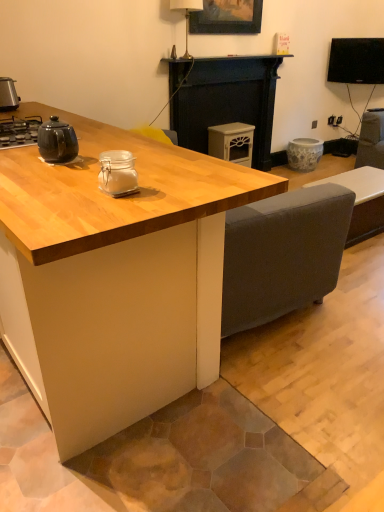
At what (x,y) coordinates should I click in order to perform the action: click on free space to the left of clear glass jar at center, which appears as the third appliance when viewed from the right. Please return your answer as a coordinate pair (x, y). This screenshot has height=512, width=384. Looking at the image, I should click on (64, 190).